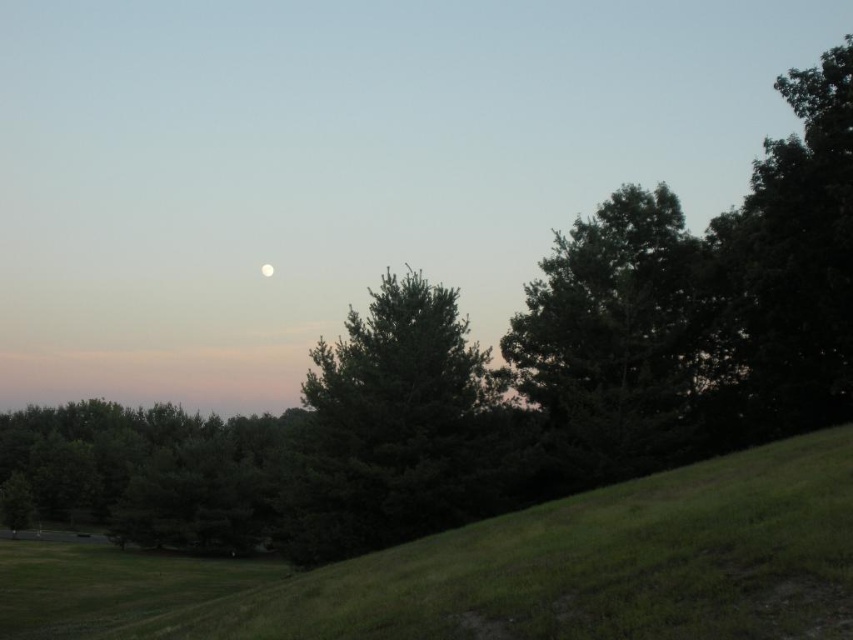
You are an astronomer observing the night sky and notice the green leafy tree at center and the white glossy moon at upper center. Which object appears wider in the image?

The green leafy tree at center appears wider than the white glossy moon at upper center because its width surpasses that of the moon.

You are an astronomer observing the night sky. You notice the green grassy hill at lower center and the white glossy moon at upper center. Which object is closer to you, the observer?

The green grassy hill at lower center is closer to you because it is positioned in front of the white glossy moon at upper center.